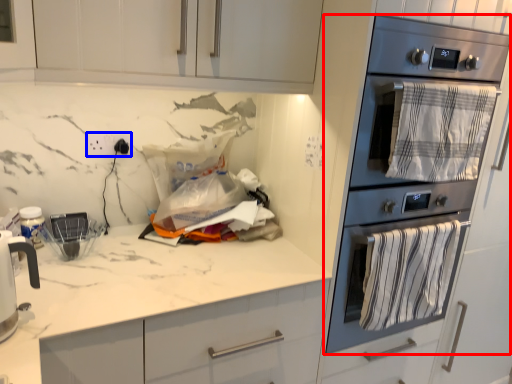
Question: Which of the following is the farthest to the observer, kitchen appliance (highlighted by a red box) or electric outlet (highlighted by a blue box)?

Choices:
 (A) kitchen appliance
 (B) electric outlet

Answer: (B)